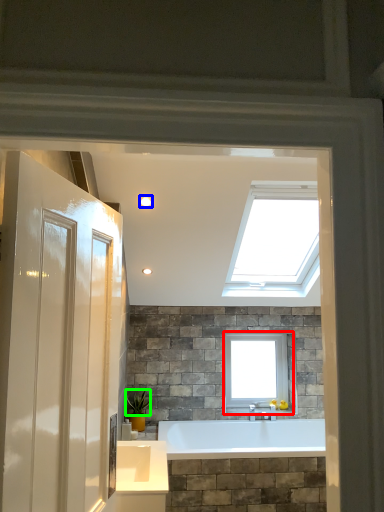
Question: Which object is the closest to the window (highlighted by a red box)? Choose among these: lighting (highlighted by a blue box) or plant (highlighted by a green box).

Choices:
 (A) lighting
 (B) plant

Answer: (B)